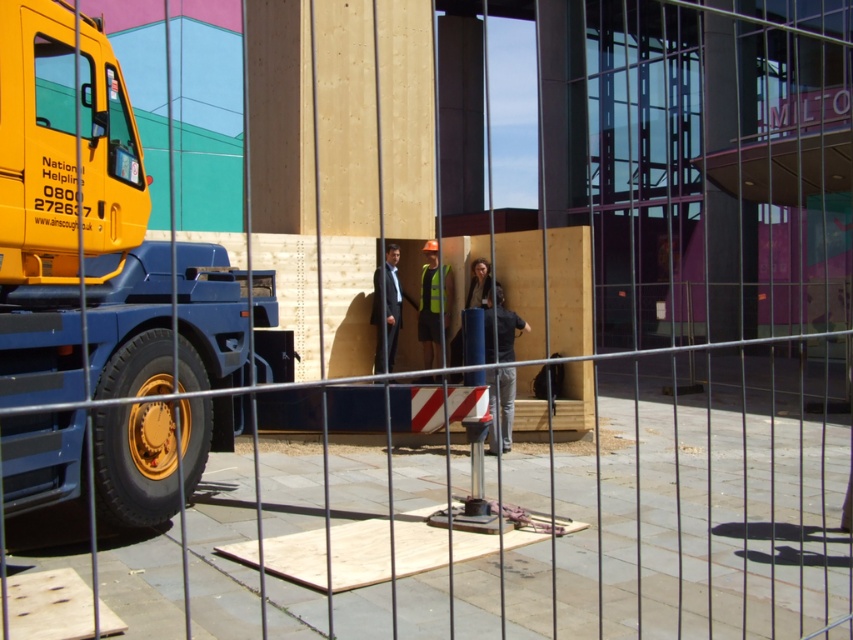
You are a pedestrian standing at the fence and want to take a photo of the yellow metallic trailer truck at left and the dark gray suit at center. Which object will appear larger in your photo?

The yellow metallic trailer truck at left will appear larger in your photo because it is closer to the viewer than the dark gray suit at center.

You are a pedestrian standing in front of the metal fence looking at the construction site. You see the yellow metallic trailer truck at left and the dark gray suit at center. Which object is taller?

The yellow metallic trailer truck at left is taller than the dark gray suit at center.